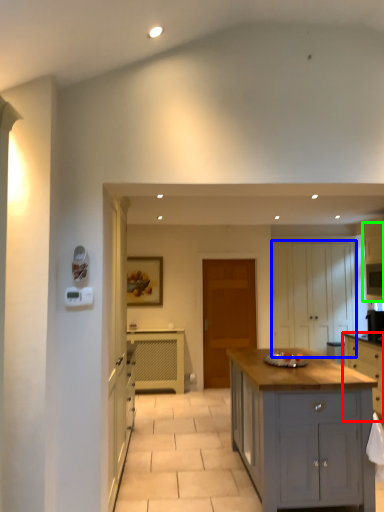
Question: Estimate the real-world distances between objects in this image. Which object is farther from cabinetry (highlighted by a red box), cabinetry (highlighted by a blue box) or cabinetry (highlighted by a green box)?

Choices:
 (A) cabinetry
 (B) cabinetry

Answer: (B)